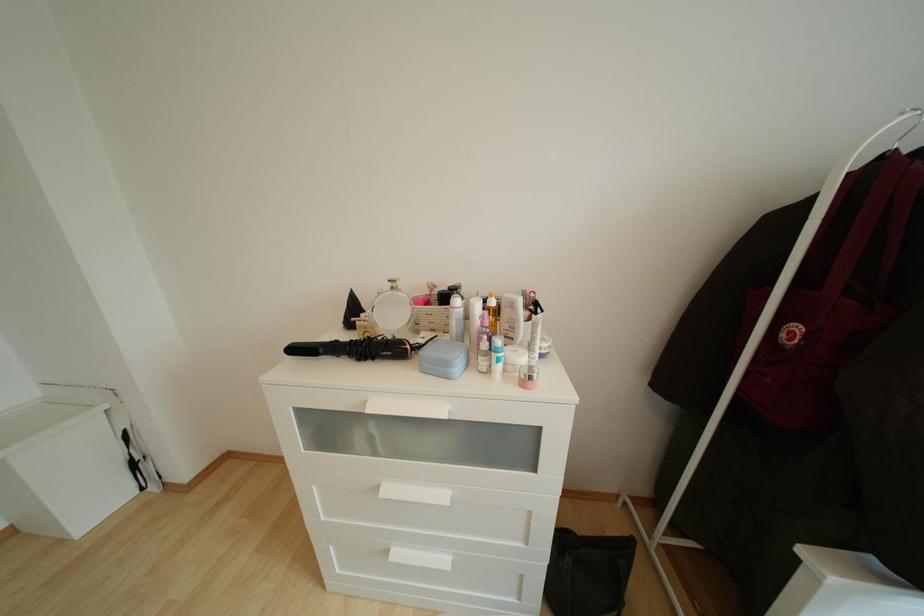
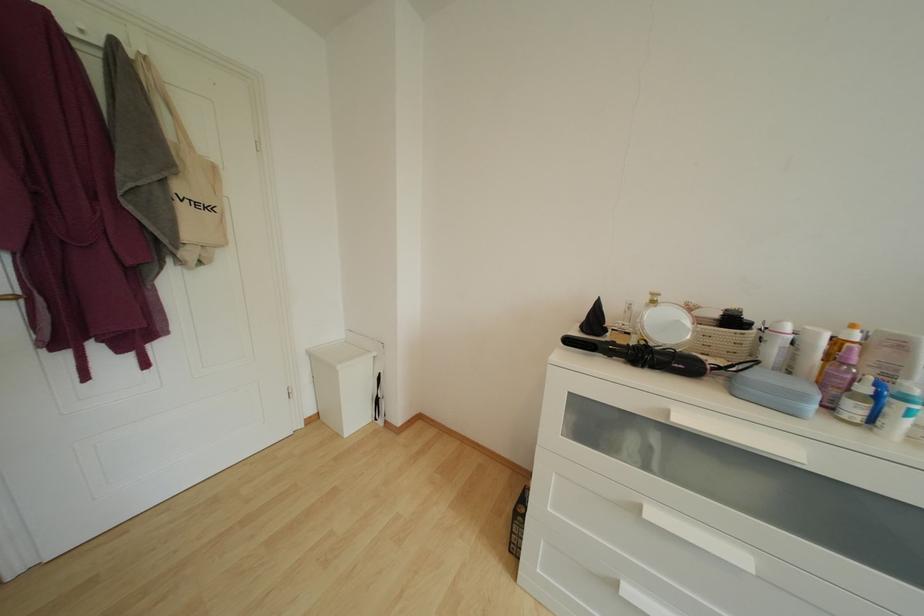
Question: The images are taken continuously from a first-person perspective. In which direction is your viewpoint rotating?

Choices:
 (A) Left
 (B) Right
 (C) Up
 (D) Down

Answer: (A)